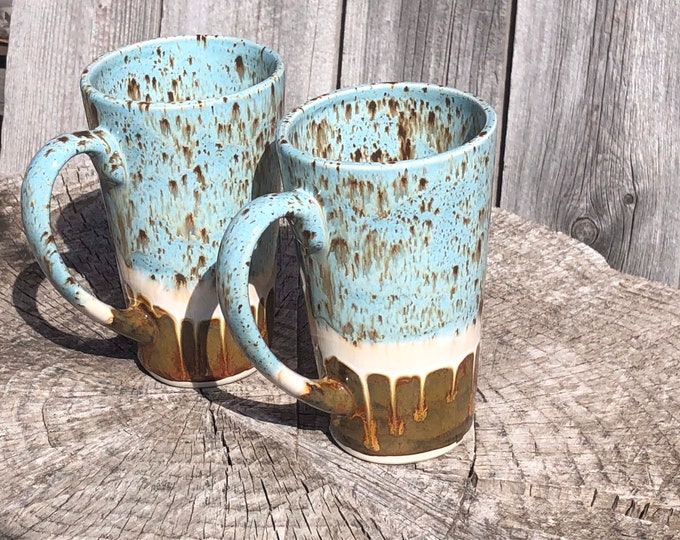
Locate an element on the screen. The image size is (680, 540). mug is located at coordinates (148, 202).